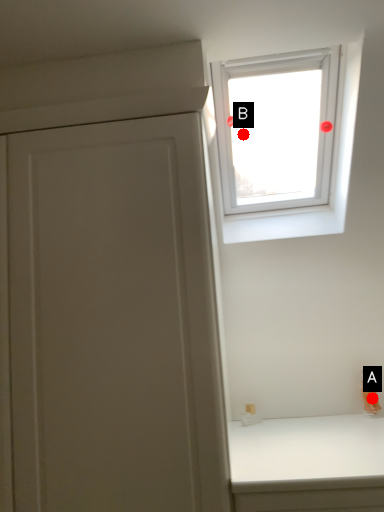
Question: Two points are circled on the image, labeled by A and B beside each circle. Which point is closer to the camera?

Choices:
 (A) A is closer
 (B) B is closer

Answer: (A)